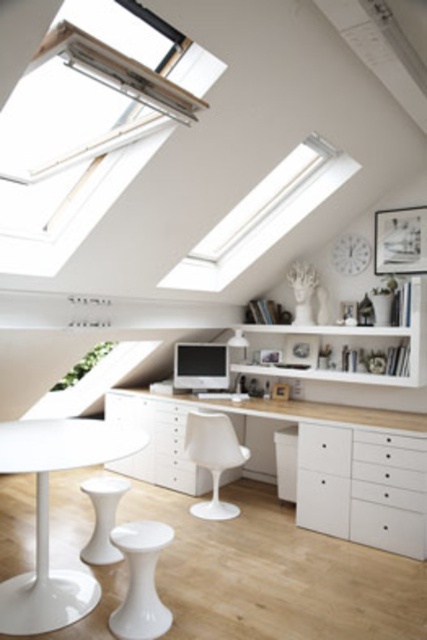
Question: Can you confirm if white plastic window at upper center is positioned to the right of white matte bookshelf at center?

Choices:
 (A) no
 (B) yes

Answer: (A)

Question: Which object appears farthest from the camera in this image?

Choices:
 (A) white matte drawer at center
 (B) white matte stool at lower center
 (C) white plastic chair at center
 (D) white matte bookshelf at center

Answer: (C)

Question: Among these objects, which one is nearest to the camera?

Choices:
 (A) white plastic chair at center
 (B) white matte drawer at center
 (C) white plastic window at upper center

Answer: (C)

Question: From the image, what is the correct spatial relationship of transparent glass window at upper center in relation to white matte drawer at center?

Choices:
 (A) left
 (B) right

Answer: (A)

Question: Estimate the real-world distances between objects in this image. Which object is closer to the white plastic window at upper center?

Choices:
 (A) white plastic chair at center
 (B) white matte/wooden computer desk at center

Answer: (A)

Question: Is white glossy table at lower left to the left of white glossy stool at lower center from the viewer's perspective?

Choices:
 (A) no
 (B) yes

Answer: (B)